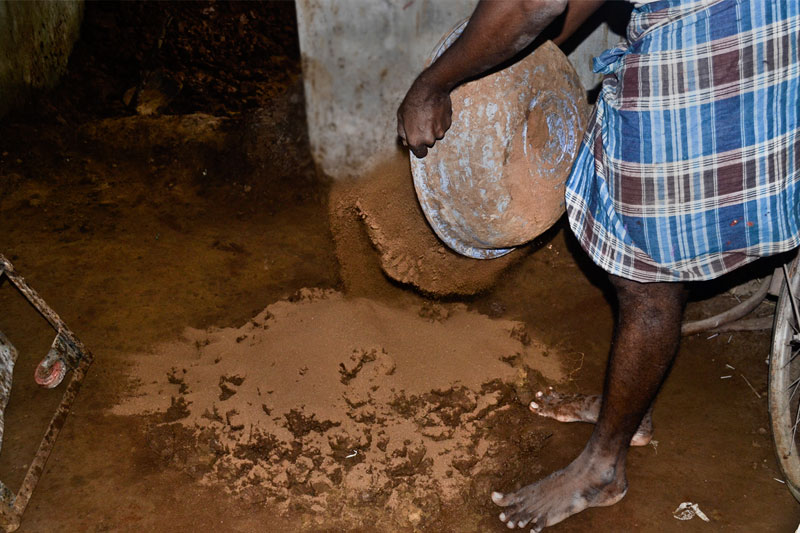
Where is `walls`? This screenshot has width=800, height=533. walls is located at coordinates point(341,84), point(45,27).